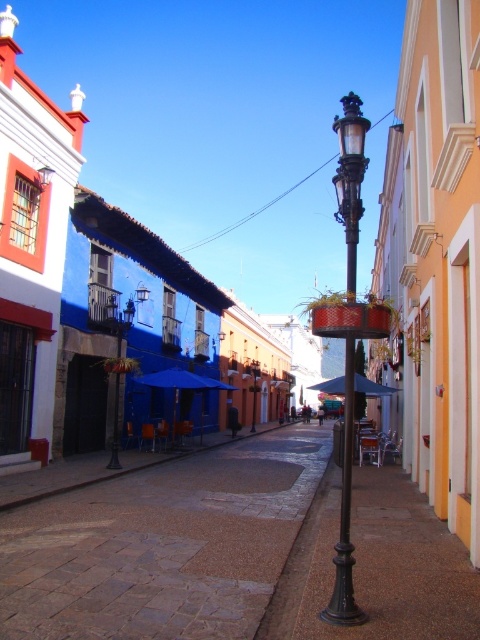
Question: Is brown cobblestone pavement at center below polished brass street light at center?

Choices:
 (A) yes
 (B) no

Answer: (A)

Question: Can you confirm if polished brass street light at center is positioned to the left of black polished street light at center?

Choices:
 (A) no
 (B) yes

Answer: (A)

Question: Is brown cobblestone pavement at center further to camera compared to polished brass streetlight at center?

Choices:
 (A) no
 (B) yes

Answer: (A)

Question: Which is farther from the brown cobblestone pavement at center?

Choices:
 (A) black polished street light at center
 (B) polished brass streetlight at center
 (C) polished brass street light at center

Answer: (A)

Question: Which of the following is the farthest from the observer?

Choices:
 (A) pyautogui.click(x=108, y=365)
 (B) pyautogui.click(x=333, y=620)

Answer: (A)

Question: Which point is closer to the camera?

Choices:
 (A) (120, 333)
 (B) (252, 404)
 (C) (348, 444)

Answer: (C)